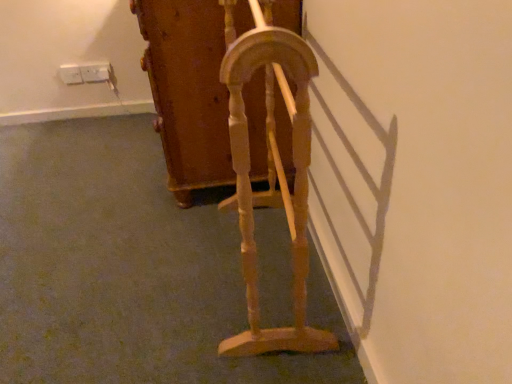
Locate an element on the screen. The image size is (512, 384). white plastic electric outlet at upper left, positioned as the 2th electric outlet in left-to-right order is located at coordinates (95, 72).

In order to click on light wood/woodenobject at center, the 1th furniture when ordered from front to back in this screenshot , I will do `click(271, 170)`.

Where is `wooden cabinet at center, positioned as the first furniture in back-to-front order`? Image resolution: width=512 pixels, height=384 pixels. wooden cabinet at center, positioned as the first furniture in back-to-front order is located at coordinates (188, 91).

Measure the distance between point (290, 172) and camera.

Point (290, 172) and camera are 1.25 meters apart.

This screenshot has width=512, height=384. I want to click on white plastic electric outlet at upper left, positioned as the 2th electric outlet in left-to-right order, so click(95, 72).

Based on their positions, is light wood/woodenobject at center, the 1th furniture when ordered from front to back, located to the left or right of white plastic electric outlet at upper left, positioned as the 2th electric outlet in left-to-right order?

In the image, light wood/woodenobject at center, the 1th furniture when ordered from front to back, appears on the right side of white plastic electric outlet at upper left, positioned as the 2th electric outlet in left-to-right order.

Is light wood/woodenobject at center, the 1th furniture when ordered from front to back, located outside white plastic electric outlet at upper left, positioned as the 2th electric outlet in left-to-right order?

Yes, light wood/woodenobject at center, the 1th furniture when ordered from front to back, is outside of white plastic electric outlet at upper left, positioned as the 2th electric outlet in left-to-right order.

Based on the photo, from a real-world perspective, between light wood/woodenobject at center, which is counted as the 2th furniture, starting from the back, and white plastic electric outlet at upper left, positioned as the 2th electric outlet in left-to-right order, who is vertically higher?

light wood/woodenobject at center, which is counted as the 2th furniture, starting from the back, is physically above.

Which of these two, light wood/woodenobject at center, which is counted as the 2th furniture, starting from the back, or white plastic electric outlet at upper left, positioned as the first electric outlet in right-to-left order, stands shorter?

white plastic electric outlet at upper left, positioned as the first electric outlet in right-to-left order.

Is wooden cabinet at center, positioned as the first furniture in back-to-front order, facing towards light wood/woodenobject at center, the 1th furniture when ordered from front to back?

No.

Is there a large distance between wooden cabinet at center, the 2th furniture viewed from the front, and light wood/woodenobject at center, which is counted as the 2th furniture, starting from the back?

That's not correct — wooden cabinet at center, the 2th furniture viewed from the front, is a little close to light wood/woodenobject at center, which is counted as the 2th furniture, starting from the back.

From a real-world perspective, between wooden cabinet at center, the 2th furniture viewed from the front, and light wood/woodenobject at center, which is counted as the 2th furniture, starting from the back, who is vertically lower?

wooden cabinet at center, the 2th furniture viewed from the front.

From the image's perspective, which is above, light wood/woodenobject at center, which is counted as the 2th furniture, starting from the back, or white plastic electric outlet at upper left, placed as the 1th electric outlet when sorted from left to right?

white plastic electric outlet at upper left, placed as the 1th electric outlet when sorted from left to right, from the image's perspective.

Considering the relative sizes of light wood/woodenobject at center, which is counted as the 2th furniture, starting from the back, and white plastic electric outlet at upper left, arranged as the 2th electric outlet when viewed from the right, in the image provided, is light wood/woodenobject at center, which is counted as the 2th furniture, starting from the back, taller than white plastic electric outlet at upper left, arranged as the 2th electric outlet when viewed from the right,?

Correct, light wood/woodenobject at center, which is counted as the 2th furniture, starting from the back, is much taller as white plastic electric outlet at upper left, arranged as the 2th electric outlet when viewed from the right.

Does light wood/woodenobject at center, the 1th furniture when ordered from front to back, turn towards white plastic electric outlet at upper left, placed as the 1th electric outlet when sorted from left to right?

No, light wood/woodenobject at center, the 1th furniture when ordered from front to back, is not facing towards white plastic electric outlet at upper left, placed as the 1th electric outlet when sorted from left to right.

Which is in front, light wood/woodenobject at center, the 1th furniture when ordered from front to back, or white plastic electric outlet at upper left, placed as the 1th electric outlet when sorted from left to right?

Positioned in front is light wood/woodenobject at center, the 1th furniture when ordered from front to back.

Looking at this image, is wooden cabinet at center, positioned as the first furniture in back-to-front order, facing towards white plastic electric outlet at upper left, positioned as the 2th electric outlet in left-to-right order?

Yes, wooden cabinet at center, positioned as the first furniture in back-to-front order, faces towards white plastic electric outlet at upper left, positioned as the 2th electric outlet in left-to-right order.

From the image's perspective, between wooden cabinet at center, the 2th furniture viewed from the front, and white plastic electric outlet at upper left, positioned as the 2th electric outlet in left-to-right order, who is located below?

wooden cabinet at center, the 2th furniture viewed from the front, from the image's perspective.

Can you confirm if wooden cabinet at center, positioned as the first furniture in back-to-front order, is thinner than white plastic electric outlet at upper left, positioned as the first electric outlet in right-to-left order?

No, wooden cabinet at center, positioned as the first furniture in back-to-front order, is not thinner than white plastic electric outlet at upper left, positioned as the first electric outlet in right-to-left order.

Image resolution: width=512 pixels, height=384 pixels. Identify the location of electric outlet that is the 1st one when counting leftward from the wooden cabinet at center, positioned as the first furniture in back-to-front order. (95, 72).

Could you measure the distance between wooden cabinet at center, positioned as the first furniture in back-to-front order, and white plastic electric outlet at upper left, placed as the 1th electric outlet when sorted from left to right?

wooden cabinet at center, positioned as the first furniture in back-to-front order, and white plastic electric outlet at upper left, placed as the 1th electric outlet when sorted from left to right, are 3.73 feet apart from each other.

Which is more to the right, wooden cabinet at center, the 2th furniture viewed from the front, or white plastic electric outlet at upper left, placed as the 1th electric outlet when sorted from left to right?

wooden cabinet at center, the 2th furniture viewed from the front, is more to the right.

Does wooden cabinet at center, positioned as the first furniture in back-to-front order, come in front of white plastic electric outlet at upper left, arranged as the 2th electric outlet when viewed from the right?

That is True.

Considering their positions, is white plastic electric outlet at upper left, placed as the 1th electric outlet when sorted from left to right, located in front of or behind light wood/woodenobject at center, the 1th furniture when ordered from front to back?

Visually, white plastic electric outlet at upper left, placed as the 1th electric outlet when sorted from left to right, is located behind light wood/woodenobject at center, the 1th furniture when ordered from front to back.

From the image's perspective, which one is positioned lower, white plastic electric outlet at upper left, arranged as the 2th electric outlet when viewed from the right, or light wood/woodenobject at center, the 1th furniture when ordered from front to back?

From the image's view, light wood/woodenobject at center, the 1th furniture when ordered from front to back, is below.

Based on the photo, between white plastic electric outlet at upper left, placed as the 1th electric outlet when sorted from left to right, and light wood/woodenobject at center, which is counted as the 2th furniture, starting from the back, which one appears on the right side from the viewer's perspective?

light wood/woodenobject at center, which is counted as the 2th furniture, starting from the back, is more to the right.

Can you tell me how much white plastic electric outlet at upper left, positioned as the 2th electric outlet in left-to-right order, and wooden cabinet at center, the 2th furniture viewed from the front, differ in facing direction?

They differ by 88.4 degrees in their facing directions.

From a real-world perspective, count 1st furnitures upward from the white plastic electric outlet at upper left, positioned as the first electric outlet in right-to-left order, and point to it. Please provide its 2D coordinates.

[(188, 91)]

From the image's perspective, is white plastic electric outlet at upper left, positioned as the 2th electric outlet in left-to-right order, on wooden cabinet at center, positioned as the first furniture in back-to-front order?

Indeed, from the image's perspective, white plastic electric outlet at upper left, positioned as the 2th electric outlet in left-to-right order, is shown above wooden cabinet at center, positioned as the first furniture in back-to-front order.

Does point (94, 81) appear closer or farther from the camera than point (210, 118)?

Clearly, point (94, 81) is more distant from the camera than point (210, 118).

Where is `electric outlet that is the 1st object to the left of the light wood/woodenobject at center, the 1th furniture when ordered from front to back, starting at the anchor`? This screenshot has height=384, width=512. electric outlet that is the 1st object to the left of the light wood/woodenobject at center, the 1th furniture when ordered from front to back, starting at the anchor is located at coordinates (95, 72).

Where is `furniture above the wooden cabinet at center, the 2th furniture viewed from the front (from a real-world perspective)`? The height and width of the screenshot is (384, 512). furniture above the wooden cabinet at center, the 2th furniture viewed from the front (from a real-world perspective) is located at coordinates (271, 170).

Based on the photo, looking at the image, which one is located closer to wooden cabinet at center, the 2th furniture viewed from the front, light wood/woodenobject at center, which is counted as the 2th furniture, starting from the back, or white plastic electric outlet at upper left, arranged as the 2th electric outlet when viewed from the right?

light wood/woodenobject at center, which is counted as the 2th furniture, starting from the back, lies closer to wooden cabinet at center, the 2th furniture viewed from the front, than the other object.

Considering their positions, is white plastic electric outlet at upper left, arranged as the 2th electric outlet when viewed from the right, positioned closer to white plastic electric outlet at upper left, positioned as the first electric outlet in right-to-left order, than wooden cabinet at center, positioned as the first furniture in back-to-front order?

white plastic electric outlet at upper left, arranged as the 2th electric outlet when viewed from the right, is positioned closer to the anchor white plastic electric outlet at upper left, positioned as the first electric outlet in right-to-left order.

Estimate the real-world distances between objects in this image. Which object is further from white plastic electric outlet at upper left, positioned as the first electric outlet in right-to-left order, light wood/woodenobject at center, which is counted as the 2th furniture, starting from the back, or wooden cabinet at center, the 2th furniture viewed from the front?

light wood/woodenobject at center, which is counted as the 2th furniture, starting from the back.

Considering their positions, is light wood/woodenobject at center, which is counted as the 2th furniture, starting from the back, positioned closer to white plastic electric outlet at upper left, arranged as the 2th electric outlet when viewed from the right, than wooden cabinet at center, positioned as the first furniture in back-to-front order?

wooden cabinet at center, positioned as the first furniture in back-to-front order, lies closer to white plastic electric outlet at upper left, arranged as the 2th electric outlet when viewed from the right, than the other object.

Which object lies nearer to the anchor point white plastic electric outlet at upper left, arranged as the 2th electric outlet when viewed from the right, white plastic electric outlet at upper left, positioned as the first electric outlet in right-to-left order, or light wood/woodenobject at center, the 1th furniture when ordered from front to back?

Based on the image, white plastic electric outlet at upper left, positioned as the first electric outlet in right-to-left order, appears to be nearer to white plastic electric outlet at upper left, arranged as the 2th electric outlet when viewed from the right.

Estimate the real-world distances between objects in this image. Which object is further from white plastic electric outlet at upper left, positioned as the 2th electric outlet in left-to-right order, white plastic electric outlet at upper left, placed as the 1th electric outlet when sorted from left to right, or light wood/woodenobject at center, which is counted as the 2th furniture, starting from the back?

light wood/woodenobject at center, which is counted as the 2th furniture, starting from the back, lies further to white plastic electric outlet at upper left, positioned as the 2th electric outlet in left-to-right order, than the other object.

Based on their spatial positions, is wooden cabinet at center, positioned as the first furniture in back-to-front order, or light wood/woodenobject at center, the 1th furniture when ordered from front to back, further from white plastic electric outlet at upper left, positioned as the 2th electric outlet in left-to-right order?

light wood/woodenobject at center, the 1th furniture when ordered from front to back.

Looking at the image, which one is located further to wooden cabinet at center, positioned as the first furniture in back-to-front order, white plastic electric outlet at upper left, arranged as the 2th electric outlet when viewed from the right, or white plastic electric outlet at upper left, positioned as the first electric outlet in right-to-left order?

Among the two, white plastic electric outlet at upper left, arranged as the 2th electric outlet when viewed from the right, is located further to wooden cabinet at center, positioned as the first furniture in back-to-front order.

Locate an element on the screen. The height and width of the screenshot is (384, 512). furniture positioned between light wood/woodenobject at center, the 1th furniture when ordered from front to back, and white plastic electric outlet at upper left, placed as the 1th electric outlet when sorted from left to right, from near to far is located at coordinates (188, 91).

This screenshot has height=384, width=512. I want to click on electric outlet between wooden cabinet at center, the 2th furniture viewed from the front, and white plastic electric outlet at upper left, positioned as the first electric outlet in right-to-left order, from front to back, so click(70, 74).

Find the location of a particular element. The height and width of the screenshot is (384, 512). electric outlet between light wood/woodenobject at center, which is counted as the 2th furniture, starting from the back, and white plastic electric outlet at upper left, positioned as the first electric outlet in right-to-left order, in the front-back direction is located at coordinates (70, 74).

You are a GUI agent. You are given a task and a screenshot of the screen. Output one action in this format:
    pyautogui.click(x=<x>, y=<y>)
    Task: Click on the furniture between light wood/woodenobject at center, the 1th furniture when ordered from front to back, and white plastic electric outlet at upper left, positioned as the first electric outlet in right-to-left order, from front to back
    
    Given the screenshot: What is the action you would take?
    pyautogui.click(x=188, y=91)